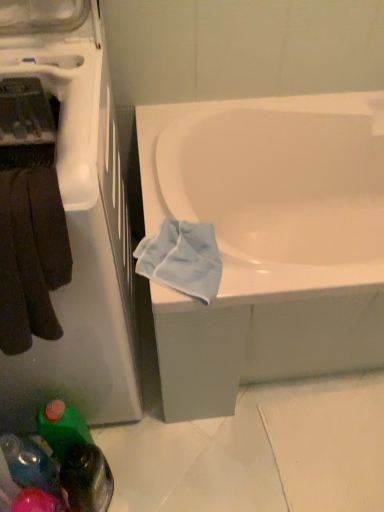
At what (x,y) coordinates should I click in order to perform the action: click on free location to the right of green plastic bottle at lower left, marked as the 1th bottle in a right-to-left arrangement. Please return your answer as a coordinate pair (x, y). Looking at the image, I should click on click(x=163, y=474).